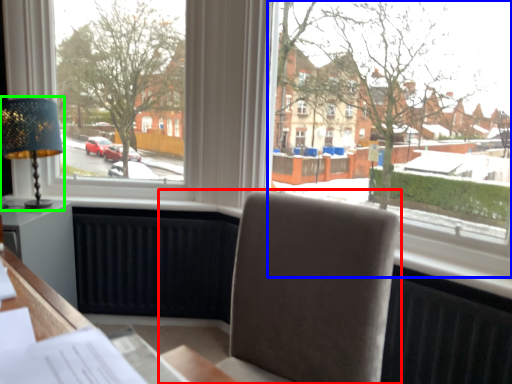
Question: Which object is the closest to the chair (highlighted by a red box)? Choose among these: window (highlighted by a blue box) or table lamp (highlighted by a green box).

Choices:
 (A) window
 (B) table lamp

Answer: (A)